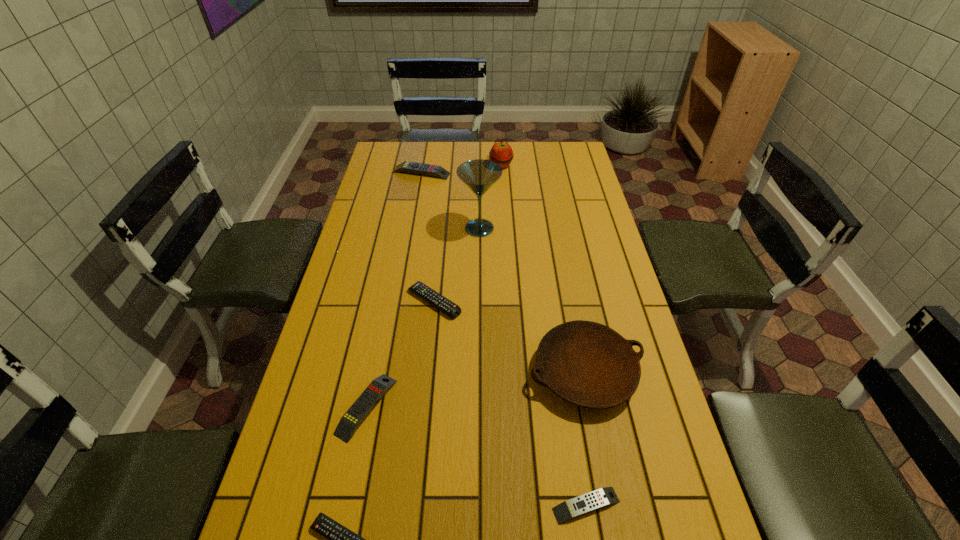
Locate an element on the screen. This screenshot has width=960, height=540. remote control that stands as the second closest to the rightmost remote control is located at coordinates (356, 414).

Point out which yellow remote control is positioned as the nearest to the third farthest object. Please provide its 2D coordinates. Your answer should be formatted as a tuple, i.e. [(x, y)], where the tuple contains the x and y coordinates of a point satisfying the conditions above.

[(410, 167)]

The image size is (960, 540). Find the location of `yellow remote control that is the second nearest to the apple`. yellow remote control that is the second nearest to the apple is located at coordinates (356, 414).

Find the location of a particular element. vacant area that satisfies the following two spatial constraints: 1. on the back side of the tallest object; 2. on the left side of the fifth tallest object is located at coordinates (402, 228).

Find the location of a particular element. vacant space that satisfies the following two spatial constraints: 1. on the front side of the farthest remote control; 2. on the right side of the rightmost yellow remote control is located at coordinates (363, 505).

Locate an element on the screen. free space that satisfies the following two spatial constraints: 1. on the back side of the second tallest object; 2. on the left side of the sixth nearest object is located at coordinates (x=480, y=165).